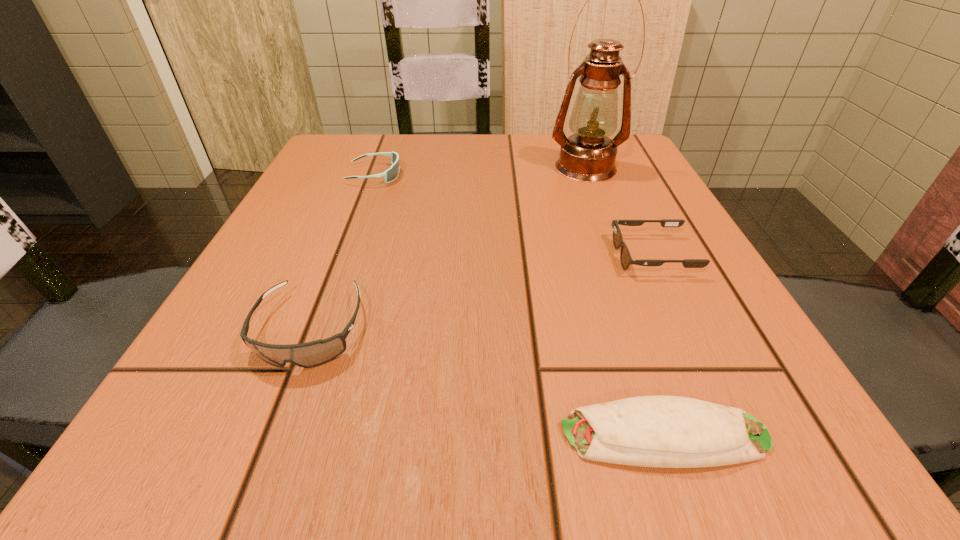
The width and height of the screenshot is (960, 540). Find the location of `vacant space located on the temples of the third farthest object`. vacant space located on the temples of the third farthest object is located at coordinates (585, 255).

Locate an element on the screen. The width and height of the screenshot is (960, 540). free space located on the temples of the third farthest object is located at coordinates (415, 255).

Where is `free location located at the bitten end of the nearest object`? Image resolution: width=960 pixels, height=540 pixels. free location located at the bitten end of the nearest object is located at coordinates (380, 435).

Where is `free space located at the bitten end of the nearest object`? The width and height of the screenshot is (960, 540). free space located at the bitten end of the nearest object is located at coordinates pyautogui.click(x=498, y=435).

This screenshot has height=540, width=960. What are the coordinates of `vacant space positioned at the bitten end of the nearest object` in the screenshot? It's located at (280, 435).

Locate an element on the screen. oil lamp that is at the far edge is located at coordinates (588, 155).

Locate an element on the screen. goggles that is positioned at the far edge is located at coordinates (391, 174).

Find the location of `object situated at the near edge`. object situated at the near edge is located at coordinates (650, 431).

Identify the location of oil lamp present at the right edge. This screenshot has width=960, height=540. (588, 155).

The image size is (960, 540). Find the location of `sunglasses located at the right edge`. sunglasses located at the right edge is located at coordinates (625, 258).